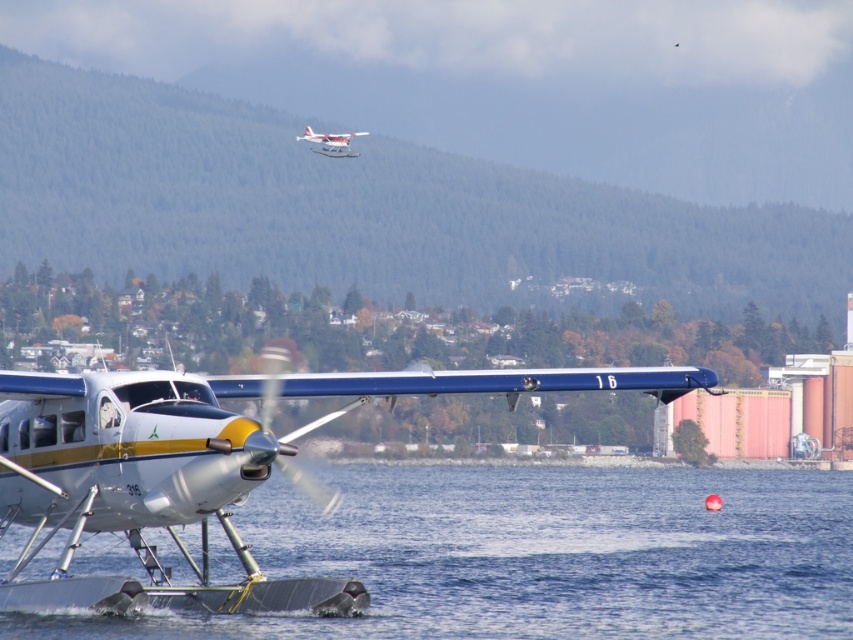
Question: Does white matte water at lower center appear under white matte airplane at upper center?

Choices:
 (A) yes
 (B) no

Answer: (A)

Question: Does white glossy seaplane at center appear on the left side of white matte airplane at upper center?

Choices:
 (A) no
 (B) yes

Answer: (A)

Question: Is white matte water at lower center below white matte airplane at upper center?

Choices:
 (A) yes
 (B) no

Answer: (A)

Question: Which object appears closest to the camera in this image?

Choices:
 (A) white matte airplane at upper center
 (B) white matte water at lower center

Answer: (B)

Question: Which of the following is the closest to the observer?

Choices:
 (A) (345, 148)
 (B) (196, 408)

Answer: (B)

Question: Which point is closer to the camera?

Choices:
 (A) white matte water at lower center
 (B) white matte airplane at upper center
 (C) white glossy seaplane at center

Answer: (C)